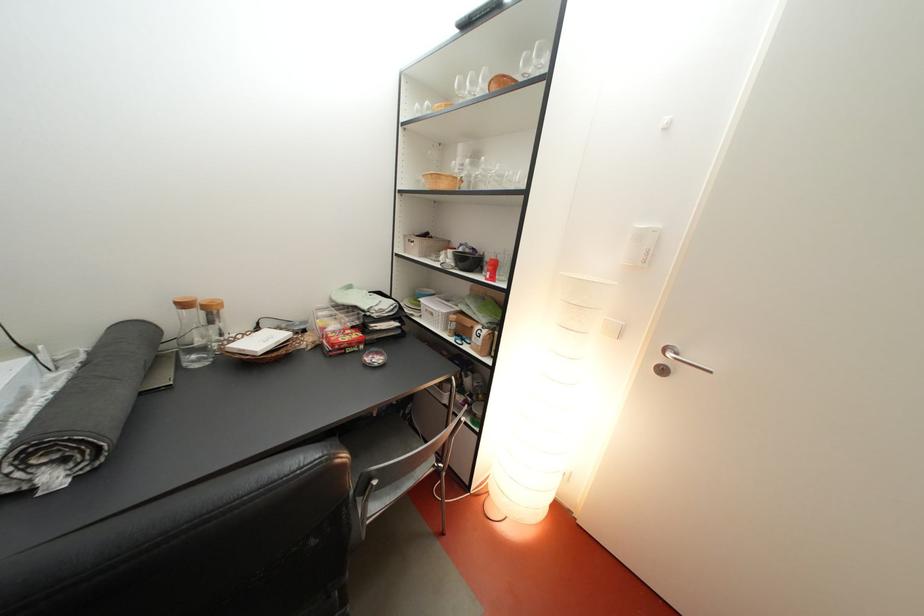
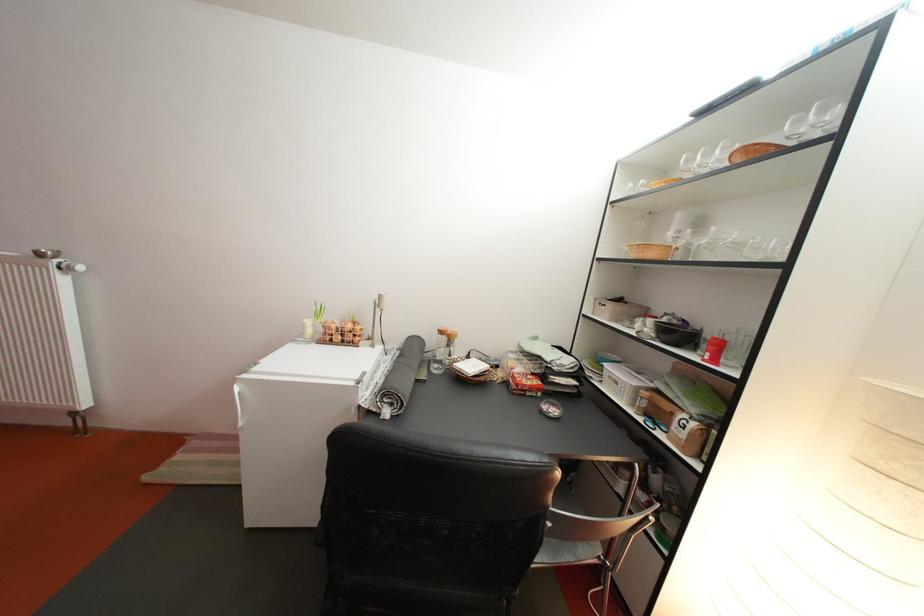
Find the pixel in the second image that matches point 42,461 in the first image.

(396, 402)